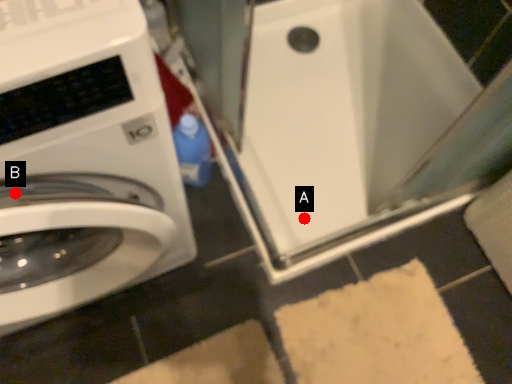
Question: Two points are circled on the image, labeled by A and B beside each circle. Which point appears farthest from the camera in this image?

Choices:
 (A) A is further
 (B) B is further

Answer: (A)